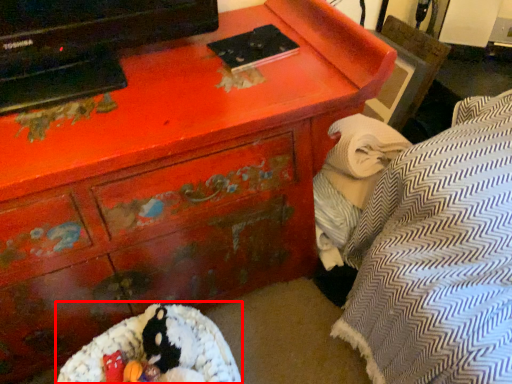
Question: From the image, what is the correct spatial relationship of bean bag chair (annotated by the red box) in relation to blanket?

Choices:
 (A) right
 (B) left

Answer: (B)